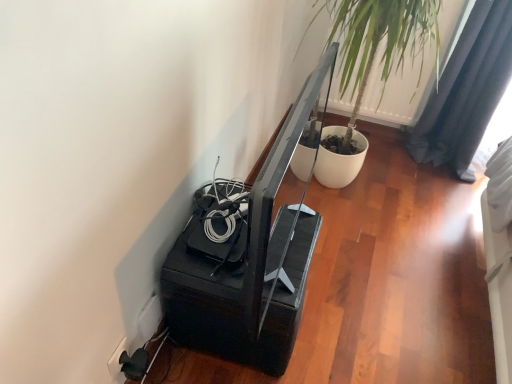
Question: Does point (345, 64) appear closer or farther from the camera than point (117, 370)?

Choices:
 (A) farther
 (B) closer

Answer: (A)

Question: Is green leafy plant at upper right situated inside white plastic electric outlet at lower left, the first electric outlet when ordered from left to right, or outside?

Choices:
 (A) outside
 (B) inside

Answer: (A)

Question: Estimate the real-world distances between objects in this image. Which object is closer to the dark gray fabric curtain at upper right?

Choices:
 (A) white plastic electric outlet at lower left, arranged as the 2th electric outlet when viewed from the right
 (B) green leafy plant at upper right
 (C) white plastic electric outlet at lower left, the 1th electric outlet viewed from the right

Answer: (B)

Question: Estimate the real-world distances between objects in this image. Which object is closer to the white plastic electric outlet at lower left, the first electric outlet when ordered from left to right?

Choices:
 (A) white plastic electric outlet at lower left, the 2th electric outlet in the left-to-right sequence
 (B) dark gray fabric curtain at upper right
 (C) green leafy plant at upper right

Answer: (A)